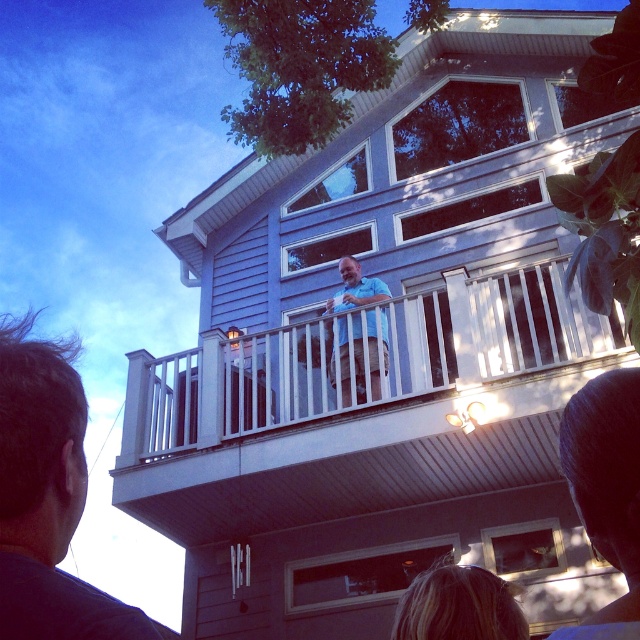
Question: Is dark brown hair at upper right positioned behind light blue shirt at upper center?

Choices:
 (A) no
 (B) yes

Answer: (A)

Question: Which point is closer to the camera taking this photo?

Choices:
 (A) (364, 280)
 (B) (621, 560)
 (C) (54, 422)

Answer: (B)

Question: Which object is the closest to the dark brown hair at upper left?

Choices:
 (A) dark brown hair at upper right
 (B) blonde hair at lower center
 (C) light blue shirt at upper center

Answer: (A)

Question: Is the position of dark brown hair at upper right more distant than that of light blue shirt at upper center?

Choices:
 (A) yes
 (B) no

Answer: (B)

Question: Which object appears closest to the camera in this image?

Choices:
 (A) dark brown hair at upper right
 (B) light blue shirt at upper center

Answer: (A)

Question: Is dark brown hair at upper left smaller than dark brown hair at upper right?

Choices:
 (A) no
 (B) yes

Answer: (A)